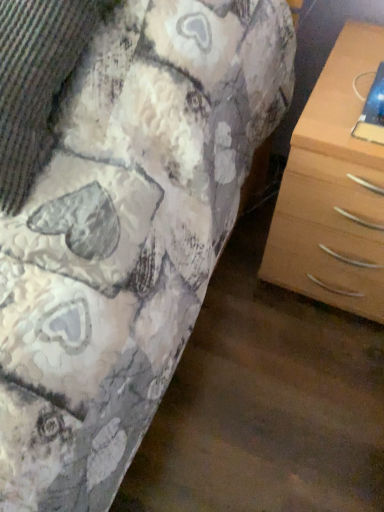
Question: Should I look upward or downward to see light brown wooden chest of drawers at right?

Choices:
 (A) up
 (B) down

Answer: (A)